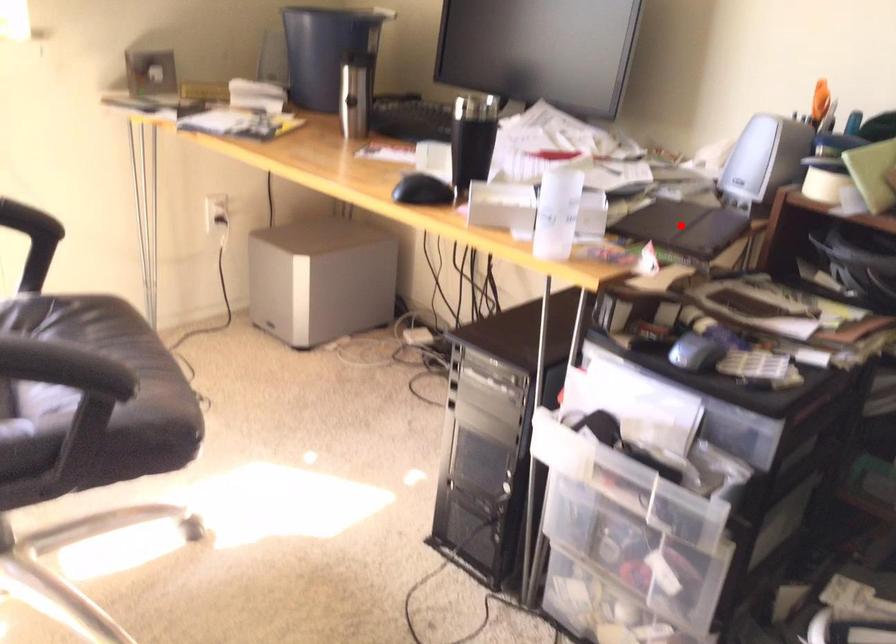
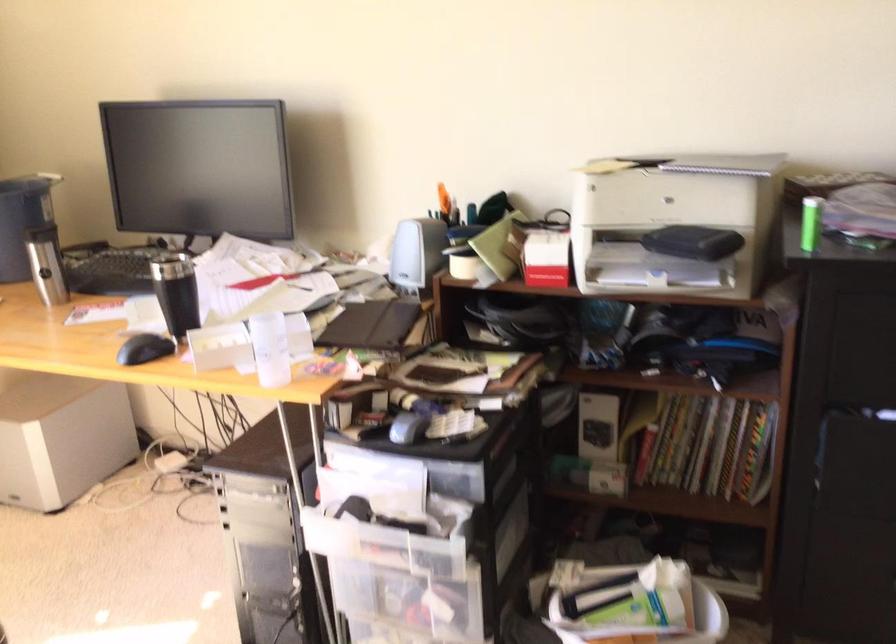
Question: I am providing you with two images of the same scene from different viewpoints. Image1 has a red point marked. In image2, the corresponding 3D location appears at what relative position? Reply with the corresponding letter.

Choices:
 (A) Closer
 (B) Farther

Answer: (B)